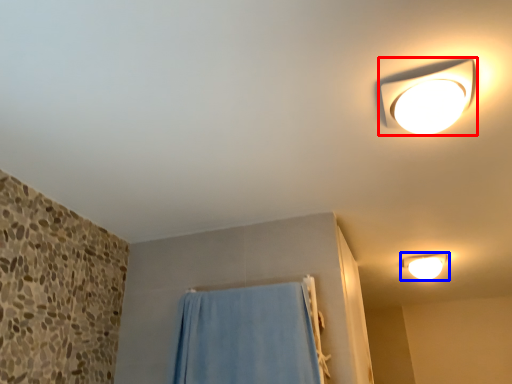
Question: Which object is closer to the camera taking this photo, lamp (highlighted by a red box) or lamp (highlighted by a blue box)?

Choices:
 (A) lamp
 (B) lamp

Answer: (A)